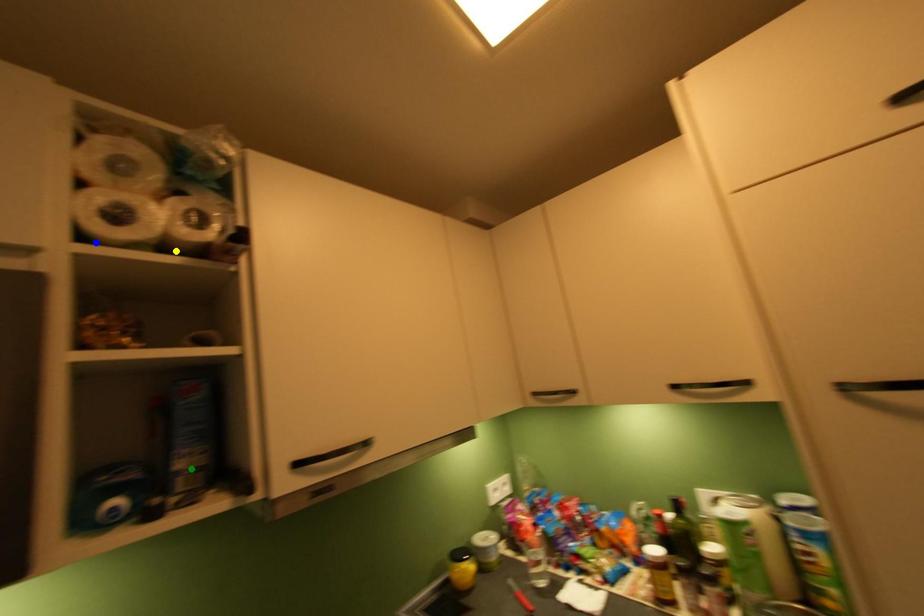
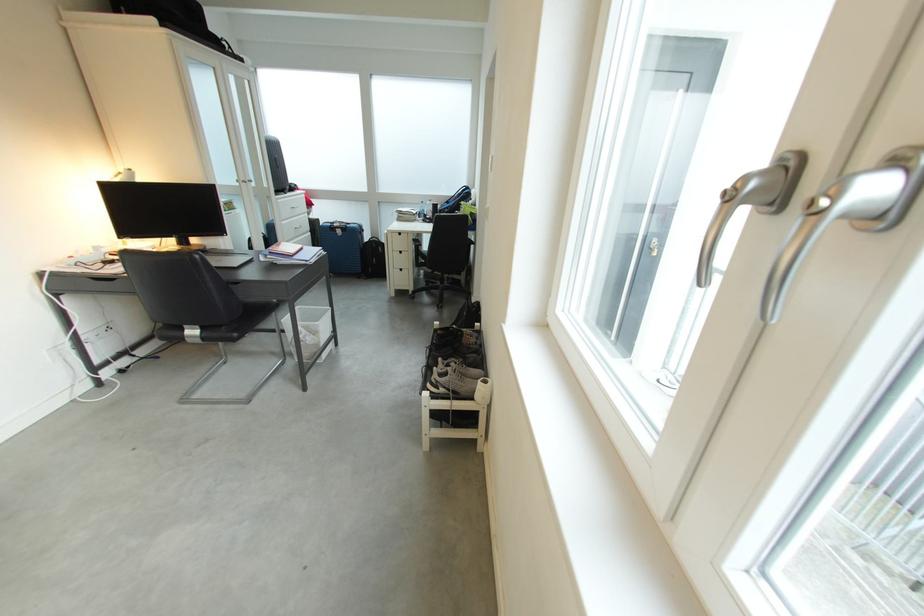
I am providing you with two images of the same scene from different viewpoints. Three points are marked in image1. Which point corresponds to a part or object that is occluded in image2?In image1, three points are marked. Which of them correspond to a part or object that is occluded in image2?Among the three points shown in image1, which one corresponds to a part or object that is no longer visible due to occlusion in image2?

Invisible in image2: blue point, yellow point, green point.